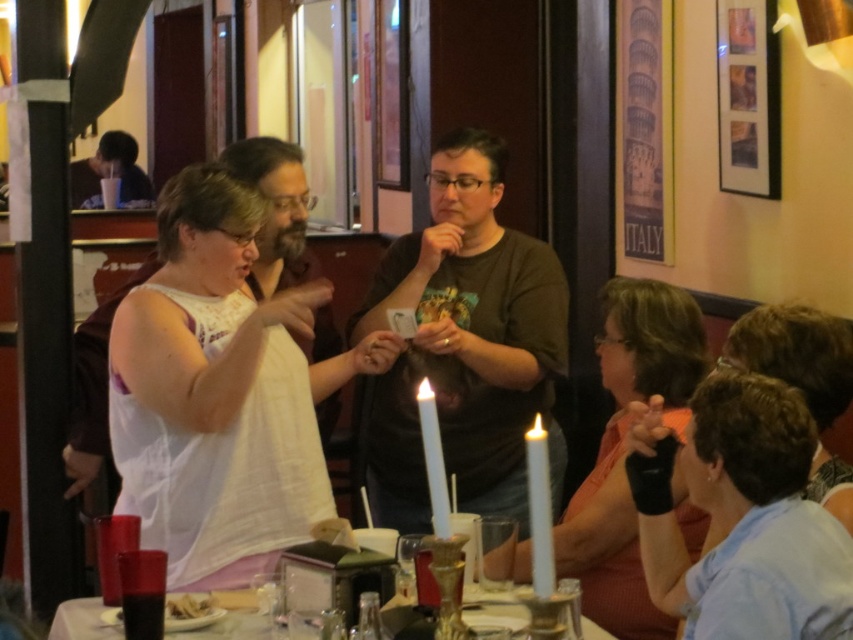
Question: Is the position of white fabric shirt at center more distant than that of dark brown bread at lower left?

Choices:
 (A) no
 (B) yes

Answer: (B)

Question: Is translucent glass table at center below white wax candle at center?

Choices:
 (A) yes
 (B) no

Answer: (A)

Question: Among these points, which one is nearest to the camera?

Choices:
 (A) (270, 496)
 (B) (535, 547)

Answer: (B)

Question: Which object is farther from the camera taking this photo?

Choices:
 (A) translucent glass table at center
 (B) light blue shirt at lower right
 (C) white fabric shirt at center

Answer: (C)

Question: Does light blue shirt at lower right appear under white wax candle at center?

Choices:
 (A) yes
 (B) no

Answer: (A)

Question: Estimate the real-world distances between objects in this image. Which object is closer to the white fabric shirt at center?

Choices:
 (A) white wax candle at lower right
 (B) dark brown bread at lower left
 (C) orange fabric at lower right

Answer: (B)